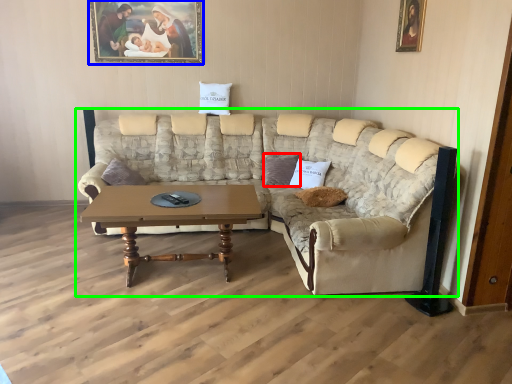
Question: Based on their relative distances, which object is nearer to pillow (highlighted by a red box)? Choose from picture frame (highlighted by a blue box) and studio couch (highlighted by a green box).

Choices:
 (A) picture frame
 (B) studio couch

Answer: (B)